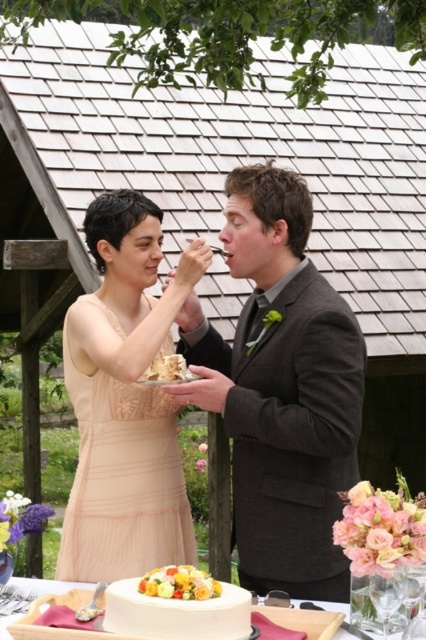
You are a photographer positioned at the origin point. You need to capture a photo of the yellow flower bouquet at center. According to the coordinates provided, in which direction should you move to reach the bouquet?

The yellow flower bouquet at center is located at point 0.912 on the x and 0.420 on the y. Since photographers are at the origin, you should move right along the x axis and slightly up along the y axis to reach the bouquet.